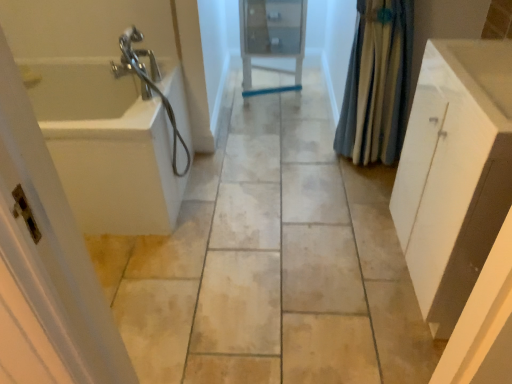
Question: Does white matte cabinet at right lie in front of white glossy sink at right?

Choices:
 (A) no
 (B) yes

Answer: (A)

Question: Is white matte cabinet at right bigger than white glossy sink at right?

Choices:
 (A) no
 (B) yes

Answer: (B)

Question: Can you confirm if white matte cabinet at right is shorter than white glossy sink at right?

Choices:
 (A) yes
 (B) no

Answer: (B)

Question: From a real-world perspective, is white matte cabinet at right physically below white glossy sink at right?

Choices:
 (A) no
 (B) yes

Answer: (B)

Question: Is white matte cabinet at right beside white glossy sink at right?

Choices:
 (A) no
 (B) yes

Answer: (A)

Question: Is point (485, 77) positioned closer to the camera than point (100, 329)?

Choices:
 (A) farther
 (B) closer

Answer: (A)

Question: Considering their positions, is white glossy sink at right located in front of or behind white plastic screen door at left?

Choices:
 (A) front
 (B) behind

Answer: (B)

Question: Would you say white glossy sink at right is inside or outside white plastic screen door at left?

Choices:
 (A) outside
 (B) inside

Answer: (A)

Question: In terms of width, does white glossy sink at right look wider or thinner when compared to white plastic screen door at left?

Choices:
 (A) wide
 (B) thin

Answer: (A)

Question: Considering the positions of white matte cabinet at right and blue fabric shower curtain at right in the image, is white matte cabinet at right wider or thinner than blue fabric shower curtain at right?

Choices:
 (A) thin
 (B) wide

Answer: (B)

Question: Based on their positions, is white matte cabinet at right located to the left or right of blue fabric shower curtain at right?

Choices:
 (A) right
 (B) left

Answer: (A)

Question: Is point (488, 238) closer or farther from the camera than point (397, 135)?

Choices:
 (A) farther
 (B) closer

Answer: (B)

Question: Based on their sizes in the image, would you say white matte cabinet at right is bigger or smaller than blue fabric shower curtain at right?

Choices:
 (A) big
 (B) small

Answer: (A)

Question: From their relative heights in the image, would you say matte glass medicine cabinet at center is taller or shorter than white matte cabinet at right?

Choices:
 (A) short
 (B) tall

Answer: (A)

Question: From the image's perspective, is matte glass medicine cabinet at center located above or below white matte cabinet at right?

Choices:
 (A) below
 (B) above

Answer: (B)